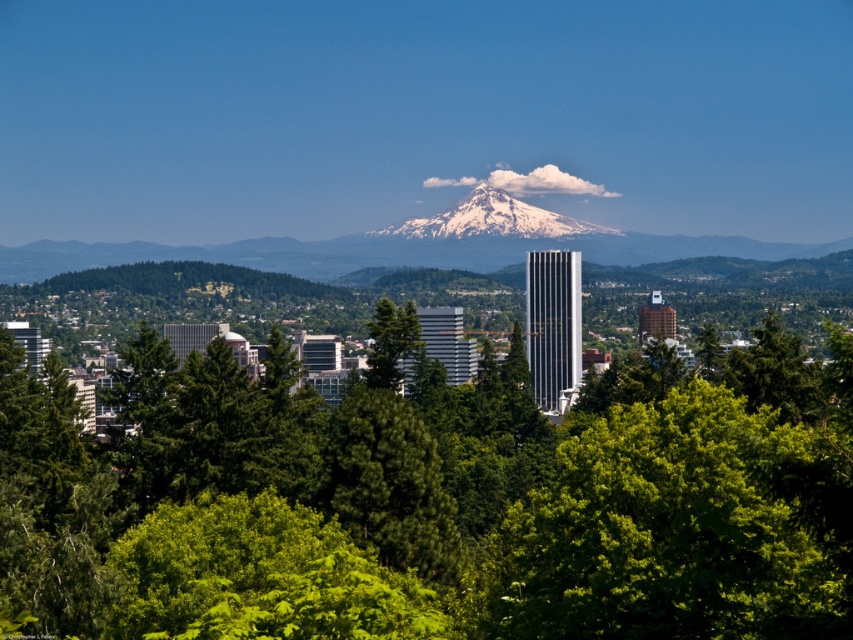
Which is more to the left, green leafy tree at center or snowy peak at center?

green leafy tree at center

Looking at this image, does green leafy tree at center appear on the right side of snowy peak at center?

In fact, green leafy tree at center is to the left of snowy peak at center.

Is point (405, 426) farther from viewer compared to point (548, 211)?

That is False.

Identify the location of green leafy tree at center. (430, 500).